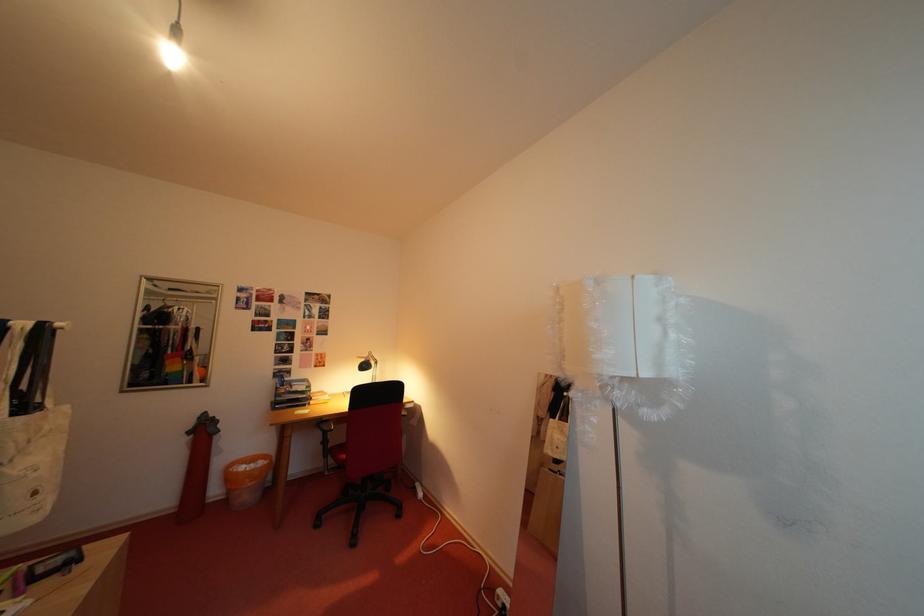
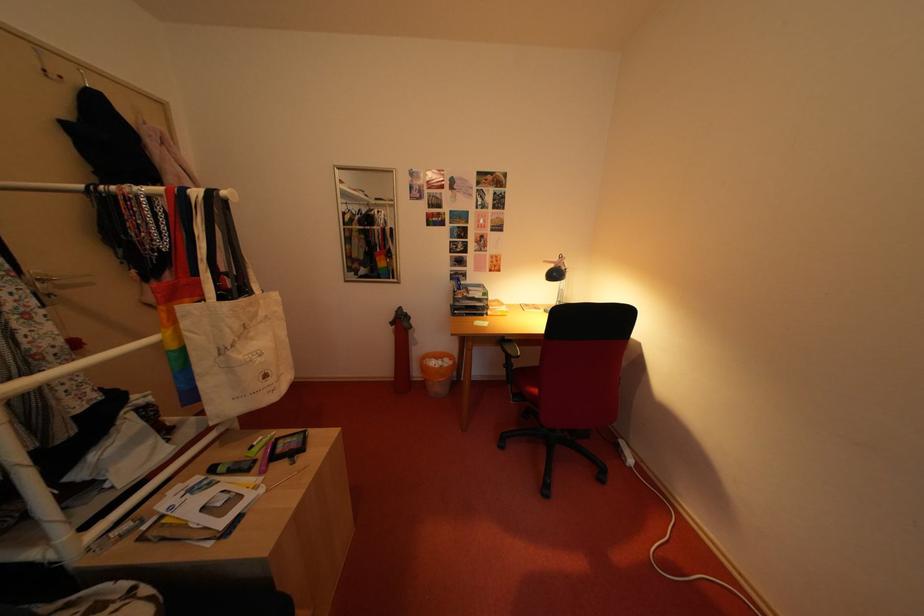
The point at (373, 365) is marked in the first image. Where is the corresponding point in the second image?

(563, 270)